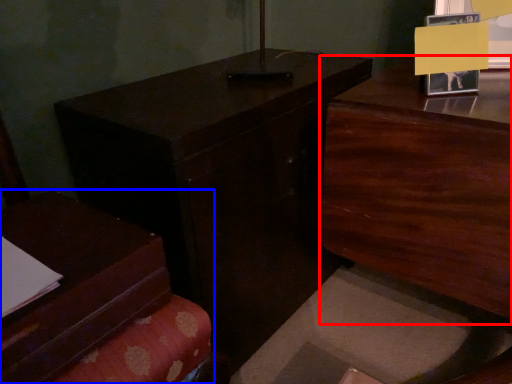
Question: Which object appears closest to the camera in this image, dresser (highlighted by a red box) or furniture (highlighted by a blue box)?

Choices:
 (A) dresser
 (B) furniture

Answer: (B)